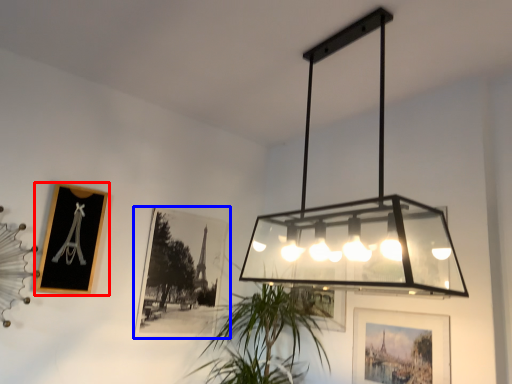
Question: Which point is closer to the camera, picture frame (highlighted by a red box) or picture frame (highlighted by a blue box)?

Choices:
 (A) picture frame
 (B) picture frame

Answer: (A)